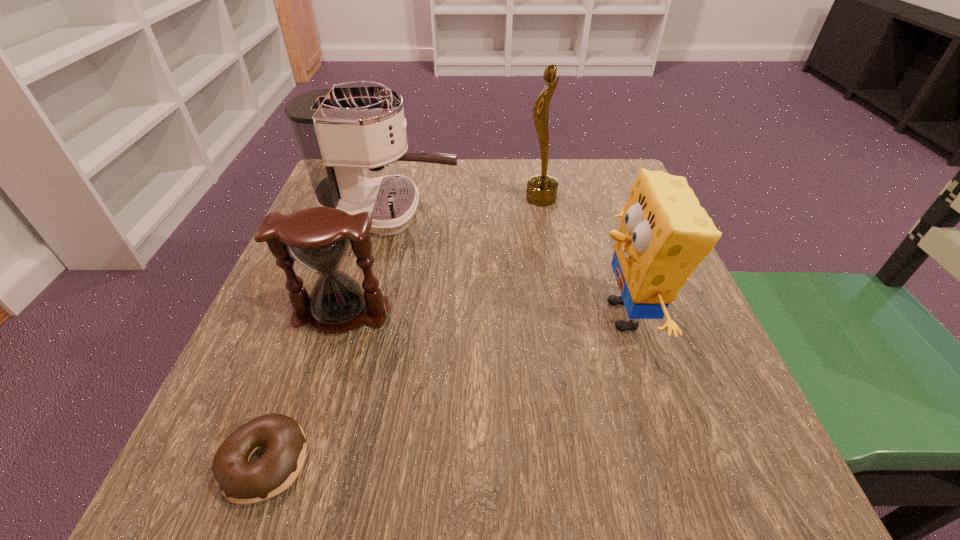
Where is `free space between the coffee maker and the rightmost object`? free space between the coffee maker and the rightmost object is located at coordinates (507, 264).

At what (x,y) coordinates should I click in order to perform the action: click on free space between the sponge and the doughnut. Please return your answer as a coordinate pair (x, y). Looking at the image, I should click on (444, 389).

Find the location of a particular element. vacant region between the sponge and the doughnut is located at coordinates (444, 389).

Where is `vacant region between the award and the coffee maker`? The height and width of the screenshot is (540, 960). vacant region between the award and the coffee maker is located at coordinates (466, 205).

You are a GUI agent. You are given a task and a screenshot of the screen. Output one action in this format:
    pyautogui.click(x=<x>, y=<y>)
    Task: Click on the vacant area between the fourth object from left to right and the sponge
    
    Given the screenshot: What is the action you would take?
    pyautogui.click(x=583, y=257)

Locate an element on the screen. The image size is (960, 540). free space between the award and the nearest object is located at coordinates (403, 330).

Find the location of a particular element. This screenshot has height=540, width=960. vacant point located between the shortest object and the rightmost object is located at coordinates (444, 389).

This screenshot has height=540, width=960. Identify the location of free point between the fourth tallest object and the doughnut. (303, 388).

The width and height of the screenshot is (960, 540). Find the location of `free spot between the award and the sponge`. free spot between the award and the sponge is located at coordinates (583, 257).

Identify which object is the third nearest to the doughnut. Please provide its 2D coordinates. Your answer should be formatted as a tuple, i.e. [(x, y)], where the tuple contains the x and y coordinates of a point satisfying the conditions above.

[(664, 234)]